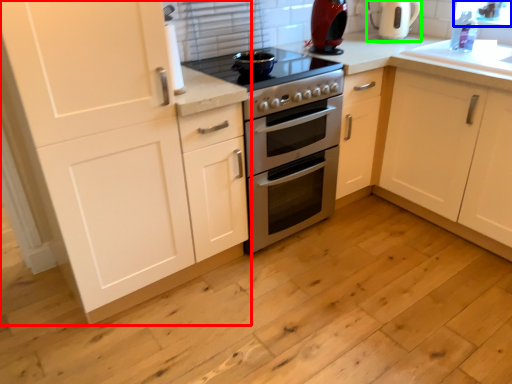
Question: Estimate the real-world distances between objects in this image. Which object is closer to cabinetry (highlighted by a red box), window screen (highlighted by a blue box) or coffeepot (highlighted by a green box)?

Choices:
 (A) window screen
 (B) coffeepot

Answer: (B)